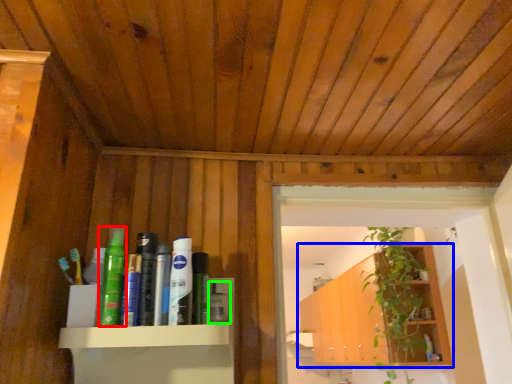
Question: Which object is the closest to the toiletry (highlighted by a red box)? Choose among these: shelf (highlighted by a blue box) or toiletry (highlighted by a green box).

Choices:
 (A) shelf
 (B) toiletry

Answer: (B)